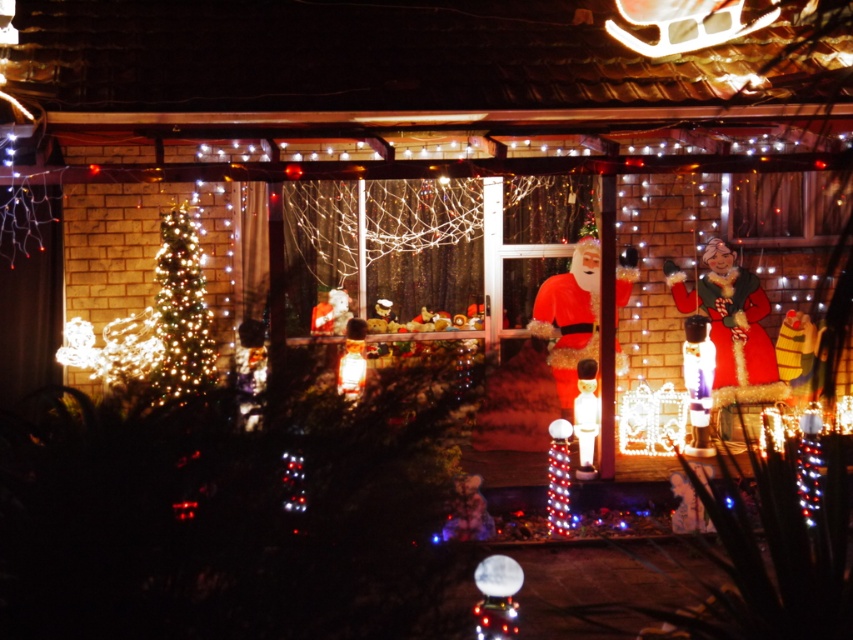
Question: Can you confirm if illuminated plastic tree at left is positioned above matte white figure at center?

Choices:
 (A) no
 (B) yes

Answer: (B)

Question: Estimate the real-world distances between objects in this image. Which object is farther from the matte red santa at right?

Choices:
 (A) illuminated plastic tree at left
 (B) matte white figure at center
 (C) matte red santa at center

Answer: (A)

Question: Which object appears closest to the camera in this image?

Choices:
 (A) matte red santa at right
 (B) matte white figure at center
 (C) matte red santa at center

Answer: (B)

Question: Which point is farther from the camera taking this photo?

Choices:
 (A) (592, 376)
 (B) (166, 285)
 (C) (741, 321)
 (D) (585, 330)

Answer: (D)

Question: Does matte red santa at right appear under matte red santa at center?

Choices:
 (A) yes
 (B) no

Answer: (A)

Question: Can you confirm if matte red santa at right is positioned to the right of matte white figure at center?

Choices:
 (A) no
 (B) yes

Answer: (B)